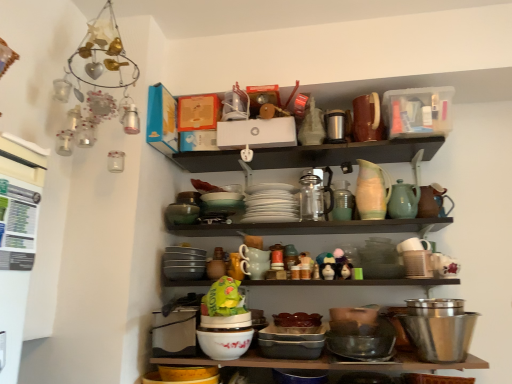
Question: From the image's perspective, is metallic thermos at upper center, acting as the 4th tableware starting from the right, above matte ceramic dishes at center, acting as the 2th shelf starting from the top?

Choices:
 (A) yes
 (B) no

Answer: (A)

Question: Does metallic thermos at upper center, arranged as the fourth tableware when viewed from the left, have a lesser height compared to matte ceramic dishes at center, the first shelf when ordered from bottom to top?

Choices:
 (A) no
 (B) yes

Answer: (A)

Question: Can we say metallic thermos at upper center, arranged as the fourth tableware when viewed from the left, lies outside matte ceramic dishes at center, acting as the 2th shelf starting from the top?

Choices:
 (A) yes
 (B) no

Answer: (A)

Question: Could you tell me if metallic thermos at upper center, arranged as the fourth tableware when viewed from the left, is turned towards matte ceramic dishes at center, acting as the 2th shelf starting from the top?

Choices:
 (A) yes
 (B) no

Answer: (B)

Question: Are metallic thermos at upper center, arranged as the fourth tableware when viewed from the left, and matte ceramic dishes at center, the first shelf when ordered from bottom to top, making contact?

Choices:
 (A) yes
 (B) no

Answer: (B)

Question: Relative to shiny metallic bowl at lower center, the second bowl when ordered from left to right, is matte ceramic dishes at center, the first shelf when ordered from bottom to top, in front or behind?

Choices:
 (A) front
 (B) behind

Answer: (B)

Question: Based on their sizes in the image, would you say matte ceramic dishes at center, acting as the 2th shelf starting from the top, is bigger or smaller than shiny metallic bowl at lower center, the second bowl when ordered from left to right?

Choices:
 (A) small
 (B) big

Answer: (B)

Question: From the image's perspective, is matte ceramic dishes at center, acting as the 2th shelf starting from the top, located above or below shiny metallic bowl at lower center, which ranks as the second bowl in right-to-left order?

Choices:
 (A) above
 (B) below

Answer: (A)

Question: In terms of width, does matte ceramic dishes at center, the first shelf when ordered from bottom to top, look wider or thinner when compared to shiny metallic bowl at lower center, the second bowl when ordered from left to right?

Choices:
 (A) wide
 (B) thin

Answer: (B)

Question: Is green plastic bag at center inside the boundaries of stainless steel bowl at lower right, which is the 3th bowl from left to right, or outside?

Choices:
 (A) outside
 (B) inside

Answer: (A)

Question: Based on their sizes in the image, would you say green plastic bag at center is bigger or smaller than stainless steel bowl at lower right, which is the 3th bowl from left to right?

Choices:
 (A) big
 (B) small

Answer: (B)

Question: From a real-world perspective, is green plastic bag at center positioned above or below stainless steel bowl at lower right, which is the 1th bowl from right to left?

Choices:
 (A) above
 (B) below

Answer: (A)

Question: Would you say green plastic bag at center is to the left or to the right of stainless steel bowl at lower right, which is the 1th bowl from right to left, in the picture?

Choices:
 (A) left
 (B) right

Answer: (A)

Question: From the image's perspective, relative to green glass jar at center, which is counted as the third tableware, starting from the right, is matte black bowl at center, the 3th bowl positioned from the right, above or below?

Choices:
 (A) below
 (B) above

Answer: (A)

Question: Looking at their shapes, would you say matte black bowl at center, which is counted as the first bowl, starting from the left, is wider or thinner than green glass jar at center, the fifth tableware in the left-to-right sequence?

Choices:
 (A) wide
 (B) thin

Answer: (A)